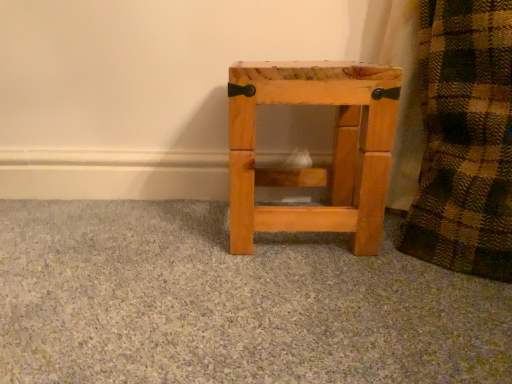
Image resolution: width=512 pixels, height=384 pixels. I want to click on free location in front of natural wood stool at center, so 311,285.